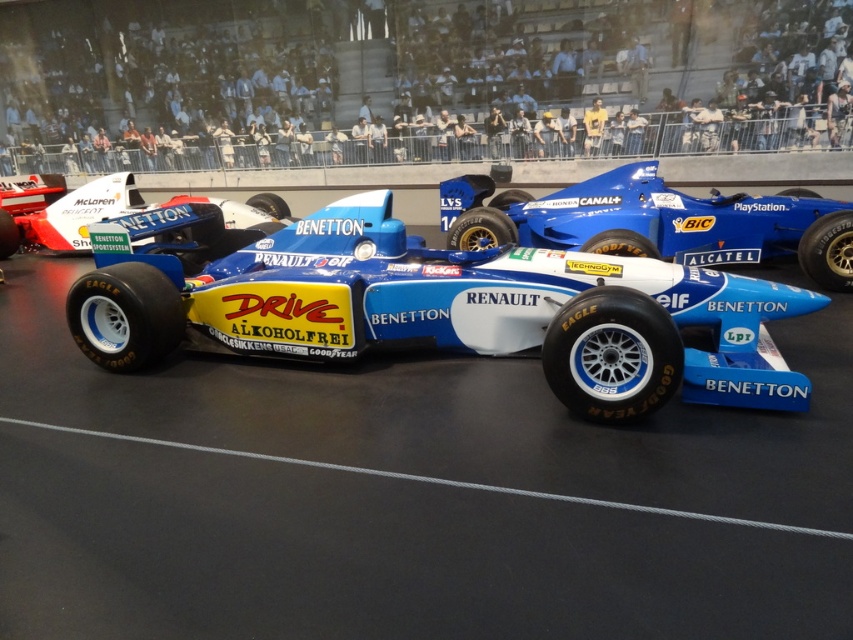
Question: Which point is farther to the camera?

Choices:
 (A) blue matte race car at center
 (B) blue rubber race track at center

Answer: (A)

Question: Among these objects, which one is farthest from the camera?

Choices:
 (A) blue glossy race car at center
 (B) matte white race car at center

Answer: (B)

Question: Observing the image, what is the correct spatial positioning of blue glossy race car at center in reference to matte white race car at center?

Choices:
 (A) below
 (B) above

Answer: (A)

Question: Can you confirm if blue glossy race car at center is positioned to the left of matte white race car at center?

Choices:
 (A) no
 (B) yes

Answer: (A)

Question: Can you confirm if blue rubber race track at center is bigger than blue matte race car at center?

Choices:
 (A) no
 (B) yes

Answer: (B)

Question: Estimate the real-world distances between objects in this image. Which object is closer to the blue glossy race car at center?

Choices:
 (A) blue matte race car at center
 (B) blue rubber race track at center
 (C) matte white race car at center

Answer: (B)